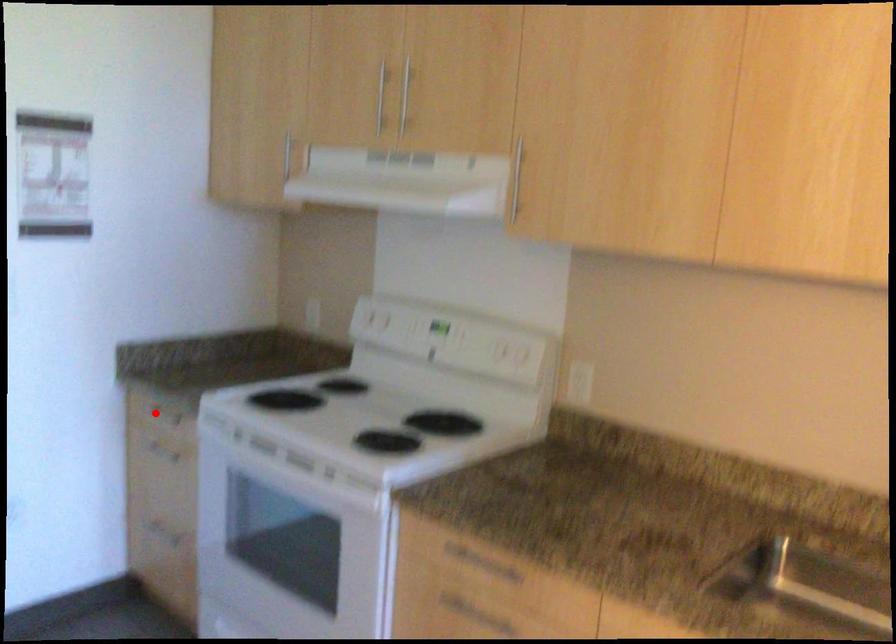
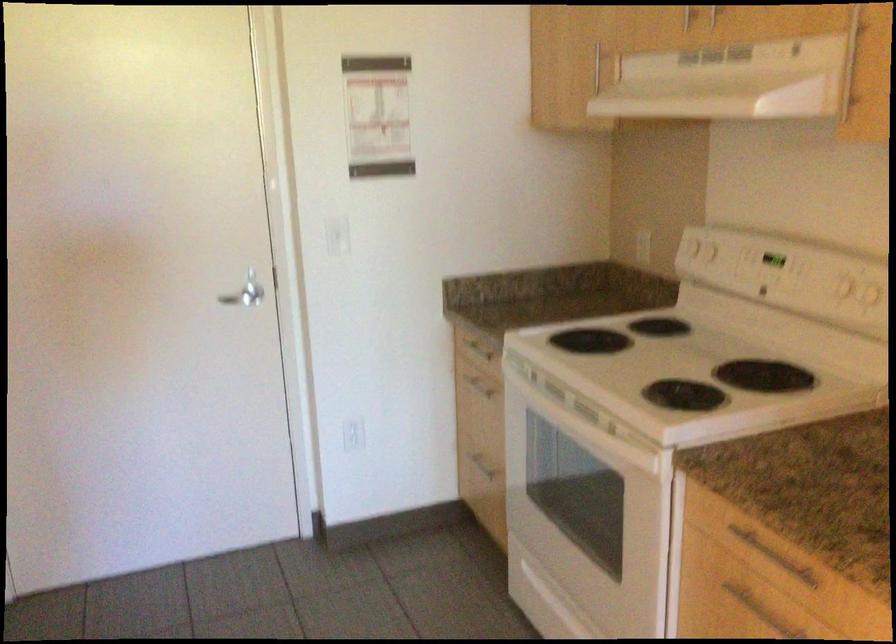
Question: I am providing you with two images of the same scene from different viewpoints. A red point is marked on the first image. Is the red point's position out of view in image 2?

Choices:
 (A) Yes
 (B) No

Answer: (B)